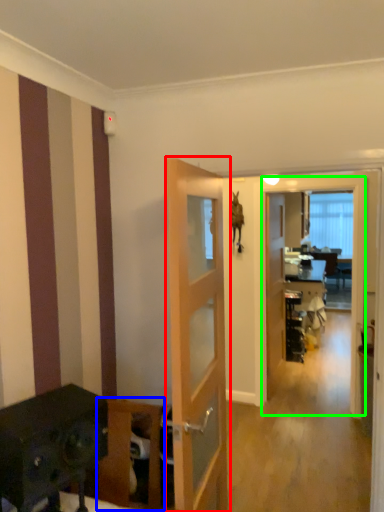
Question: Considering the real-world distances, which object is farthest from door (highlighted by a red box)? furniture (highlighted by a blue box) or screen door (highlighted by a green box)?

Choices:
 (A) furniture
 (B) screen door

Answer: (B)